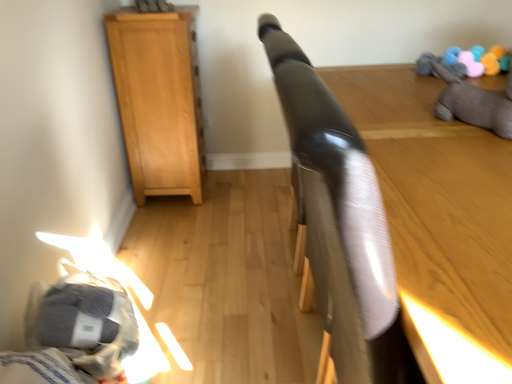
The image size is (512, 384). What do you see at coordinates (390, 222) in the screenshot?
I see `glossy black headboard at upper center, which ranks as the 2th furniture in left-to-right order` at bounding box center [390, 222].

I want to click on soft woolen balls at upper right, so click(x=466, y=61).

Describe the element at coordinates (159, 99) in the screenshot. I see `light brown wood cabinet at left, marked as the 1th furniture in a back-to-front arrangement` at that location.

What are the coordinates of `light brown wood cabinet at left, the second furniture positioned from the right` in the screenshot? It's located at (159, 99).

Image resolution: width=512 pixels, height=384 pixels. Find the location of `gray plush toy at upper right`. gray plush toy at upper right is located at coordinates (475, 104).

Considering the positions of objects glossy black headboard at upper center, the 1th furniture when ordered from right to left, and soft woolen balls at upper right in the image provided, who is behind, glossy black headboard at upper center, the 1th furniture when ordered from right to left, or soft woolen balls at upper right?

soft woolen balls at upper right is further away from the camera.

Are glossy black headboard at upper center, the first furniture viewed from the front, and soft woolen balls at upper right located far from each other?

No, glossy black headboard at upper center, the first furniture viewed from the front, is not far away from soft woolen balls at upper right.

Is glossy black headboard at upper center, the first furniture viewed from the front, spatially inside soft woolen balls at upper right, or outside of it?

glossy black headboard at upper center, the first furniture viewed from the front, cannot be found inside soft woolen balls at upper right.

From the image's perspective, is glossy black headboard at upper center, the first furniture viewed from the front, beneath soft woolen balls at upper right?

Correct, glossy black headboard at upper center, the first furniture viewed from the front, appears lower than soft woolen balls at upper right in the image.

Which of these two, gray plush toy at upper right or glossy black headboard at upper center, the second furniture viewed from the back, stands taller?

Standing taller between the two is glossy black headboard at upper center, the second furniture viewed from the back.

Which object is thinner, gray plush toy at upper right or glossy black headboard at upper center, the first furniture viewed from the front?

Thinner between the two is gray plush toy at upper right.

From the image's perspective, between gray plush toy at upper right and glossy black headboard at upper center, which ranks as the 2th furniture in left-to-right order, who is located below?

From the image's view, glossy black headboard at upper center, which ranks as the 2th furniture in left-to-right order, is below.

Is gray plush toy at upper right looking in the opposite direction of glossy black headboard at upper center, the 1th furniture when ordered from right to left?

gray plush toy at upper right is not turned away from glossy black headboard at upper center, the 1th furniture when ordered from right to left.

Is light brown wood cabinet at left, the 2th furniture when ordered from front to back, thinner than gray fabric bed at lower left?

In fact, light brown wood cabinet at left, the 2th furniture when ordered from front to back, might be wider than gray fabric bed at lower left.

Visually, is light brown wood cabinet at left, marked as the 1th furniture in a back-to-front arrangement, positioned to the left or to the right of gray fabric bed at lower left?

Based on their positions, light brown wood cabinet at left, marked as the 1th furniture in a back-to-front arrangement, is located to the left of gray fabric bed at lower left.

Is light brown wood cabinet at left, marked as the 1th furniture in a back-to-front arrangement, turned away from gray fabric bed at lower left?

No.

Can gray fabric bed at lower left be found inside light brown wood cabinet at left, marked as the 1th furniture in a back-to-front arrangement?

No, gray fabric bed at lower left is not surrounded by light brown wood cabinet at left, marked as the 1th furniture in a back-to-front arrangement.

Looking at this image, is soft woolen balls at upper right turned away from light brown wood cabinet at left, the 1th furniture from the left?

No, soft woolen balls at upper right is not facing away from light brown wood cabinet at left, the 1th furniture from the left.

How different are the orientations of soft woolen balls at upper right and light brown wood cabinet at left, the 1th furniture from the left, in degrees?

The angular difference between soft woolen balls at upper right and light brown wood cabinet at left, the 1th furniture from the left, is 179 degrees.

Is point (507, 65) less distant than point (186, 118)?

Yes.

Find the location of a particular element. bed on the left of gray plush toy at upper right is located at coordinates (76, 334).

Does gray fabric bed at lower left appear on the left side of gray plush toy at upper right?

Correct, you'll find gray fabric bed at lower left to the left of gray plush toy at upper right.

Is gray plush toy at upper right inside gray fabric bed at lower left?

No, gray plush toy at upper right is located outside of gray fabric bed at lower left.

From the image's perspective, is soft woolen balls at upper right located above or below gray plush toy at upper right?

soft woolen balls at upper right is situated higher than gray plush toy at upper right in the image.

In terms of size, does soft woolen balls at upper right appear bigger or smaller than gray plush toy at upper right?

Clearly, soft woolen balls at upper right is smaller in size than gray plush toy at upper right.

Is soft woolen balls at upper right with gray plush toy at upper right?

No, soft woolen balls at upper right is not in contact with gray plush toy at upper right.

From a real-world perspective, who is located higher, soft woolen balls at upper right or gray plush toy at upper right?

From a 3D spatial view, gray plush toy at upper right is above.

Considering the positions of points (140, 152) and (474, 48), is point (140, 152) farther from camera compared to point (474, 48)?

Yes, it is behind point (474, 48).

Could you tell me if light brown wood cabinet at left, the second furniture positioned from the right, is turned towards soft woolen balls at upper right?

No.

Considering the positions of objects light brown wood cabinet at left, the second furniture positioned from the right, and soft woolen balls at upper right in the image provided, who is in front, light brown wood cabinet at left, the second furniture positioned from the right, or soft woolen balls at upper right?

soft woolen balls at upper right is closer to the camera.

Which furniture is the 1st one when counting from the left side of the soft woolen balls at upper right? Please provide its 2D coordinates.

[(390, 222)]

The image size is (512, 384). Identify the location of animal on the right of glossy black headboard at upper center, which ranks as the 2th furniture in left-to-right order. (475, 104).

When comparing their distances from soft woolen balls at upper right, does light brown wood cabinet at left, the second furniture positioned from the right, or glossy black headboard at upper center, the first furniture viewed from the front, seem further?

light brown wood cabinet at left, the second furniture positioned from the right, is positioned further to the anchor soft woolen balls at upper right.

Looking at the image, which one is located further to soft woolen balls at upper right, light brown wood cabinet at left, marked as the 1th furniture in a back-to-front arrangement, or gray plush toy at upper right?

light brown wood cabinet at left, marked as the 1th furniture in a back-to-front arrangement, is further to soft woolen balls at upper right.

Based on their spatial positions, is soft woolen balls at upper right or light brown wood cabinet at left, the 1th furniture from the left, closer to gray fabric bed at lower left?

light brown wood cabinet at left, the 1th furniture from the left, is positioned closer to the anchor gray fabric bed at lower left.

Estimate the real-world distances between objects in this image. Which object is further from gray fabric bed at lower left, gray plush toy at upper right or glossy black headboard at upper center, the 1th furniture when ordered from right to left?

gray plush toy at upper right.

Looking at this image, when comparing their distances from glossy black headboard at upper center, the second furniture viewed from the back, does soft woolen balls at upper right or gray fabric bed at lower left seem closer?

soft woolen balls at upper right is closer to glossy black headboard at upper center, the second furniture viewed from the back.

Based on their spatial positions, is light brown wood cabinet at left, the 2th furniture when ordered from front to back, or glossy black headboard at upper center, which ranks as the 2th furniture in left-to-right order, further from gray fabric bed at lower left?

Among the two, light brown wood cabinet at left, the 2th furniture when ordered from front to back, is located further to gray fabric bed at lower left.

When comparing their distances from soft woolen balls at upper right, does gray plush toy at upper right or glossy black headboard at upper center, the 1th furniture when ordered from right to left, seem further?

glossy black headboard at upper center, the 1th furniture when ordered from right to left, lies further to soft woolen balls at upper right than the other object.

Based on their spatial positions, is gray fabric bed at lower left or soft woolen balls at upper right closer to light brown wood cabinet at left, the second furniture positioned from the right?

gray fabric bed at lower left is closer to light brown wood cabinet at left, the second furniture positioned from the right.

Find the location of a particular element. animal between glossy black headboard at upper center, the first furniture viewed from the front, and light brown wood cabinet at left, the 1th furniture from the left, along the z-axis is located at coordinates (475, 104).

Where is `toy between glossy black headboard at upper center, the 1th furniture when ordered from right to left, and light brown wood cabinet at left, the second furniture positioned from the right, from front to back`? toy between glossy black headboard at upper center, the 1th furniture when ordered from right to left, and light brown wood cabinet at left, the second furniture positioned from the right, from front to back is located at coordinates (466, 61).

You are a GUI agent. You are given a task and a screenshot of the screen. Output one action in this format:
    pyautogui.click(x=<x>, y=<y>)
    Task: Click on the bed positioned between glossy black headboard at upper center, the 1th furniture when ordered from right to left, and light brown wood cabinet at left, the second furniture positioned from the right, from near to far
    
    Given the screenshot: What is the action you would take?
    pyautogui.click(x=76, y=334)

Locate an element on the screen. furniture situated between gray fabric bed at lower left and gray plush toy at upper right from left to right is located at coordinates (390, 222).